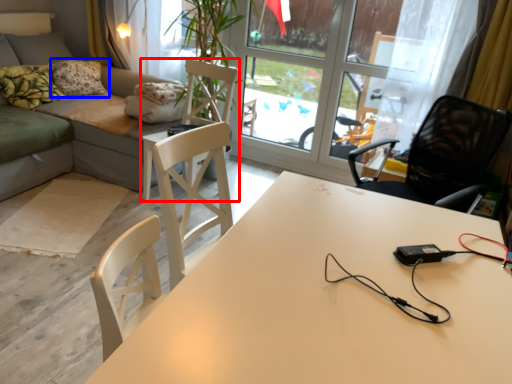
Question: Which object appears farthest to the camera in this image, chair (highlighted by a red box) or pillow (highlighted by a blue box)?

Choices:
 (A) chair
 (B) pillow

Answer: (B)